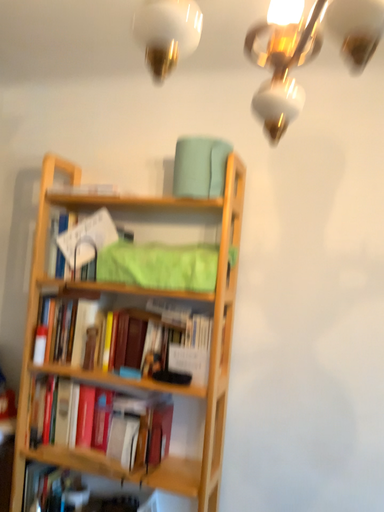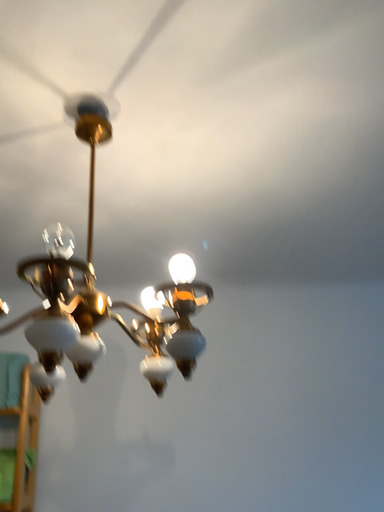
Question: Which way did the camera rotate in the video?

Choices:
 (A) rotated upward
 (B) rotated downward

Answer: (A)